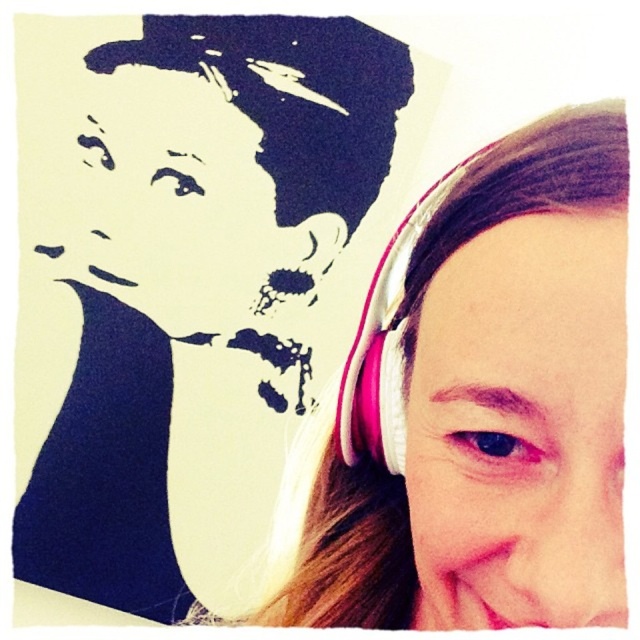
Which is above, pink fabric headphones at right or pink matte headphones at right?

pink fabric headphones at right

Measure the distance between pink fabric headphones at right and camera.

pink fabric headphones at right is 4.45 feet away from camera.

Who is more distant from viewer, (307, 381) or (540, 202)?

Positioned behind is point (307, 381).

This screenshot has height=640, width=640. Identify the location of pink fabric headphones at right. (188, 288).

Which is more to the right, pink matte headphones at right or pink fabric earphone at upper right?

pink fabric earphone at upper right is more to the right.

Identify the location of pink matte headphones at right. (484, 412).

Does pink fabric headphones at right have a lesser height compared to pink fabric earphone at upper right?

No.

Who is more forward, (x=84, y=497) or (x=387, y=436)?

Positioned in front is point (x=387, y=436).

This screenshot has width=640, height=640. In order to click on pink fabric headphones at right in this screenshot , I will do `click(188, 288)`.